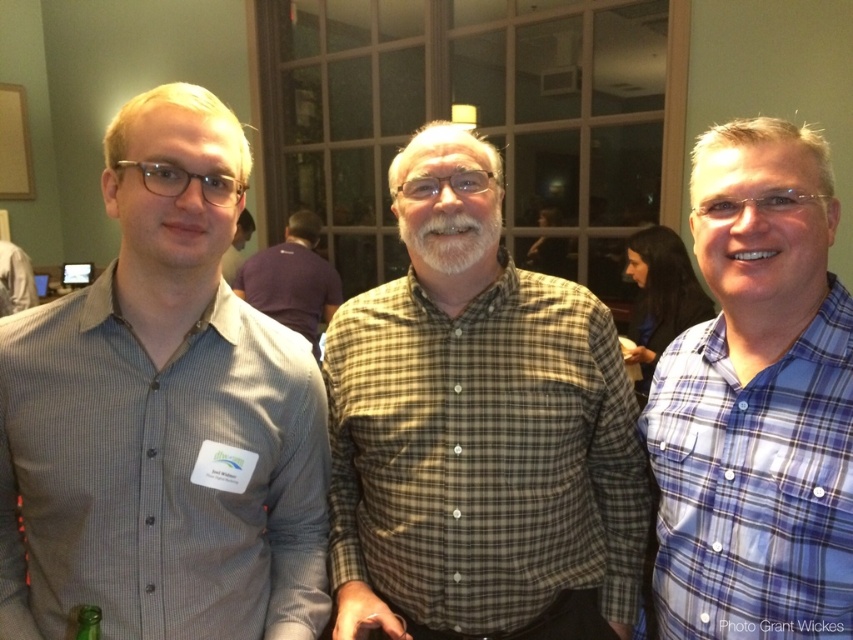
Which is more to the right, blue plaid shirt at right or matte gray shirt at center?

blue plaid shirt at right

Is blue plaid shirt at right to the left of matte gray shirt at center from the viewer's perspective?

Incorrect, blue plaid shirt at right is not on the left side of matte gray shirt at center.

Is point (676, 368) farther from camera compared to point (241, 250)?

No, (676, 368) is in front of (241, 250).

Find the location of a particular element. Image resolution: width=853 pixels, height=640 pixels. blue plaid shirt at right is located at coordinates (757, 403).

Between brown plaid shirt at center and plaid shirt at center, which one has less height?

Standing shorter between the two is plaid shirt at center.

Is brown plaid shirt at center closer to the viewer compared to plaid shirt at center?

Yes.

Who is more forward, (457, 600) or (253, 275)?

Point (457, 600) is in front.

At what (x,y) coordinates should I click in order to perform the action: click on brown plaid shirt at center. Please return your answer as a coordinate pair (x, y). The height and width of the screenshot is (640, 853). Looking at the image, I should click on (479, 429).

Between point (204, 438) and point (80, 611), which one is positioned behind?

The point (204, 438) is behind.

Does gray button-down shirt at left have a greater height compared to green glass bottle at lower left?

Correct, gray button-down shirt at left is much taller as green glass bottle at lower left.

This screenshot has width=853, height=640. Describe the element at coordinates (163, 416) in the screenshot. I see `gray button-down shirt at left` at that location.

Identify the location of gray button-down shirt at left. The image size is (853, 640). point(163,416).